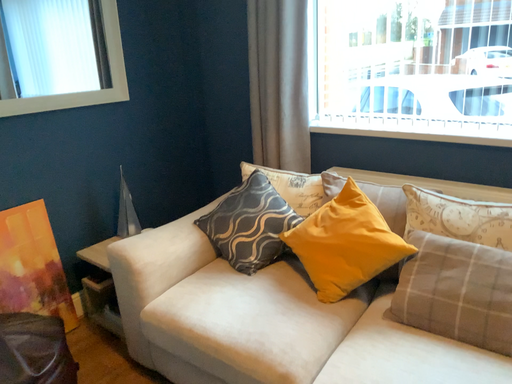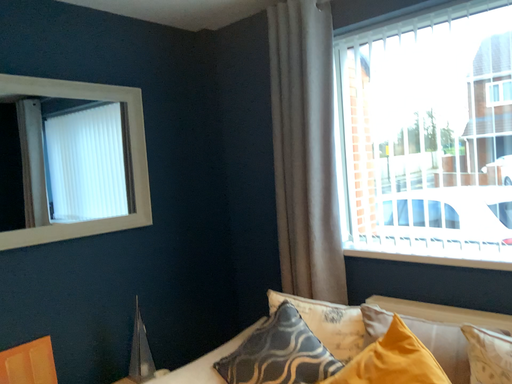
Question: Which way did the camera rotate in the video?

Choices:
 (A) rotated upward
 (B) rotated downward

Answer: (A)